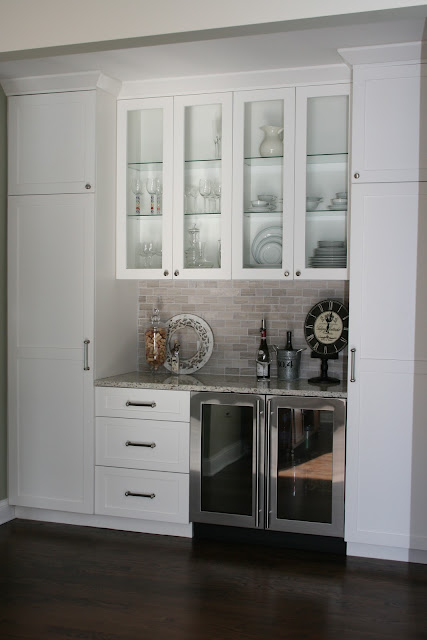
Where is `glass`? This screenshot has height=640, width=427. glass is located at coordinates (230, 454).